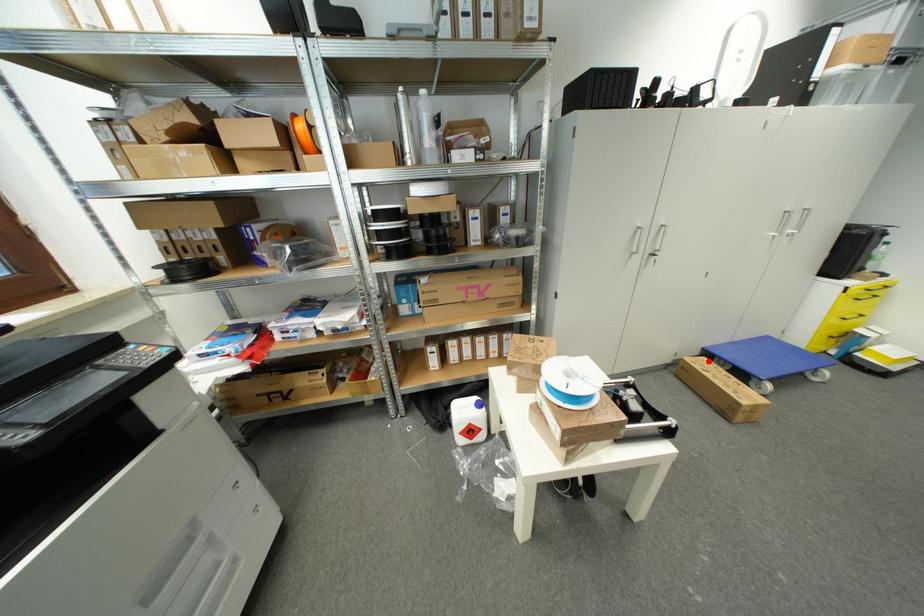
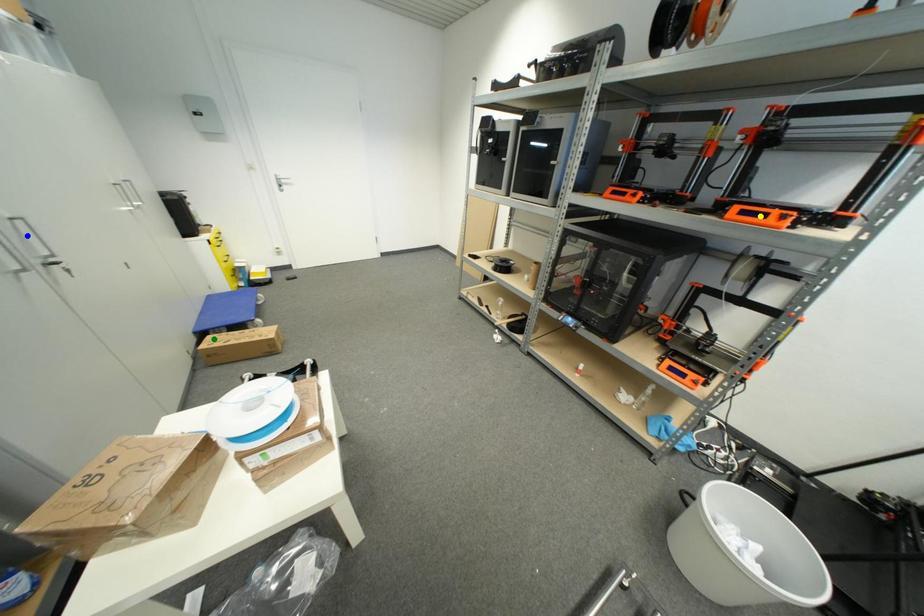
Question: I am providing you with two images of the same scene from different viewpoints. A red point is marked on the first image. You are given multiple points on the second image. Which mark in image 2 goes with the point in image 1?

Choices:
 (A) blue point
 (B) yellow point
 (C) green point

Answer: (C)